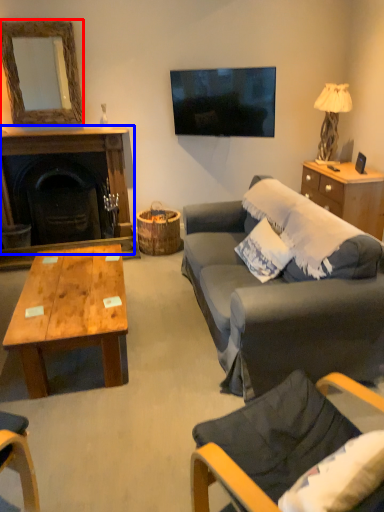
Question: Which of the following is the farthest to the observer, mirror (highlighted by a red box) or fireplace (highlighted by a blue box)?

Choices:
 (A) mirror
 (B) fireplace

Answer: (B)